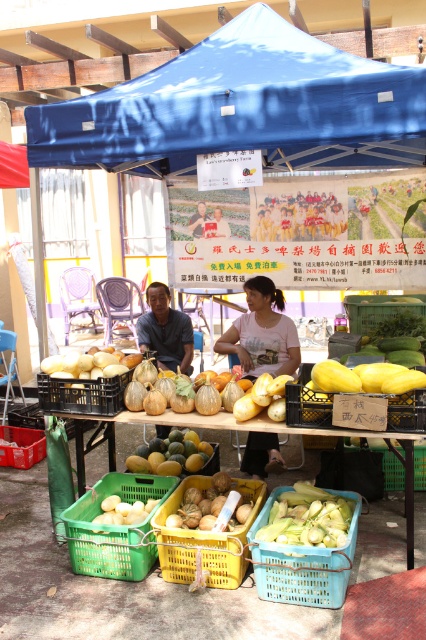
Question: Does yellow matte melon basket at center appear under dark blue shirt at center?

Choices:
 (A) yes
 (B) no

Answer: (A)

Question: Among these points, which one is nearest to the camera?

Choices:
 (A) (316, 580)
 (B) (290, 342)
 (C) (382, 81)

Answer: (C)

Question: Estimate the real-world distances between objects in this image. Which object is farther from the matte yellow shirt at center?

Choices:
 (A) yellow matte melon basket at center
 (B) yellow plastic basket at center
 (C) matte white shirt at center
 (D) green plastic basket at lower right

Answer: (B)

Question: Is green matte melon at center thinner than green plastic basket at center?

Choices:
 (A) yes
 (B) no

Answer: (A)

Question: Does yellow plastic basket at center appear over green matte corn at lower center?

Choices:
 (A) no
 (B) yes

Answer: (A)

Question: Which object is the farthest from the dark blue shirt at center?

Choices:
 (A) yellow matte melon at center
 (B) green matte melon at center
 (C) green plastic basket at center

Answer: (C)